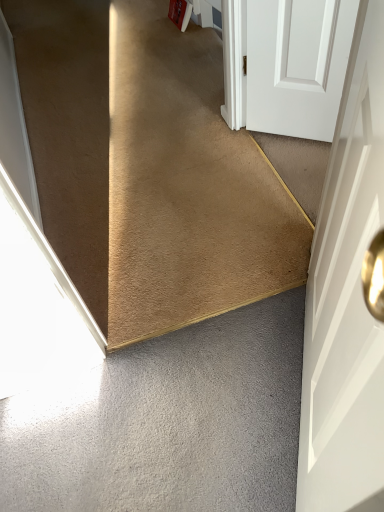
Question: Is carpet at center taller or shorter than gray matte concrete at lower left?

Choices:
 (A) tall
 (B) short

Answer: (A)

Question: Based on their positions, is carpet at center located to the left or right of gray matte concrete at lower left?

Choices:
 (A) left
 (B) right

Answer: (A)

Question: Estimate the real-world distances between objects in this image. Which object is closer to the carpet at center?

Choices:
 (A) gray matte concrete at lower left
 (B) white matte door at right

Answer: (A)

Question: Estimate the real-world distances between objects in this image. Which object is closer to the carpet at center?

Choices:
 (A) white matte door at right
 (B) gray matte concrete at lower left

Answer: (B)